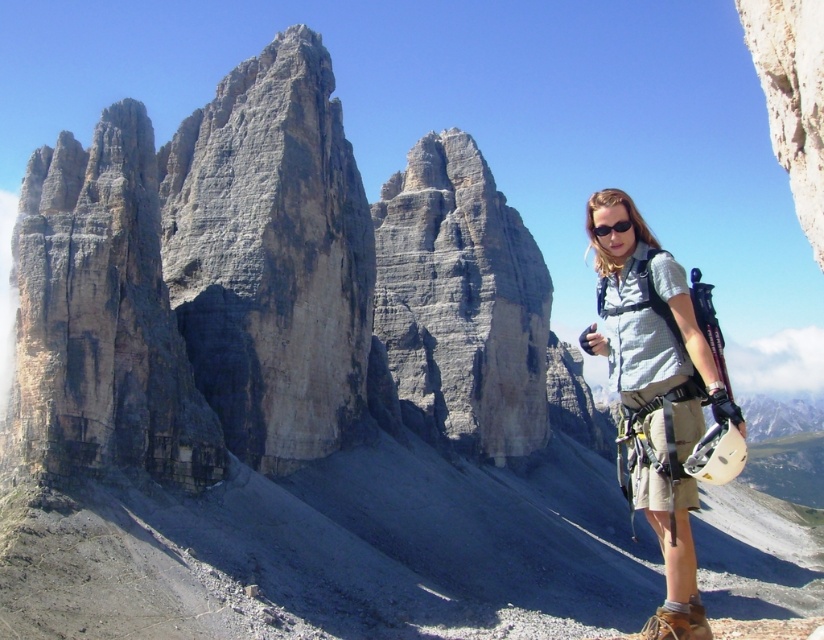
You are a photographer taking a picture of the mountain climber. You notice the light gray mesh shirt at right and the black matte sunglasses at right in your frame. Which object is closer to the camera?

The light gray mesh shirt at right is closer to the camera because it is in front of the black matte sunglasses at right.

You are a photographer taking a picture of the climber in the scene. You notice the light gray mesh shirt at right and the black matte sunglasses at right. Which object is more to the right?

The light gray mesh shirt at right is positioned on the right side of the black matte sunglasses at right, so the light gray mesh shirt at right is more to the right.

You are a photographer positioned at the left side of the scene. You want to take a photo of the light gray mesh shirt at right and the black matte sunglasses at right. If your camera has a focal length of 50mm, which object should you focus on first to ensure both are in sharp focus?

The light gray mesh shirt at right is 4.81 meters from black matte sunglasses at right. To ensure both are in sharp focus with a 50mm lens, focus on the black matte sunglasses at right since it is closer to the camera and within the depth of field range.